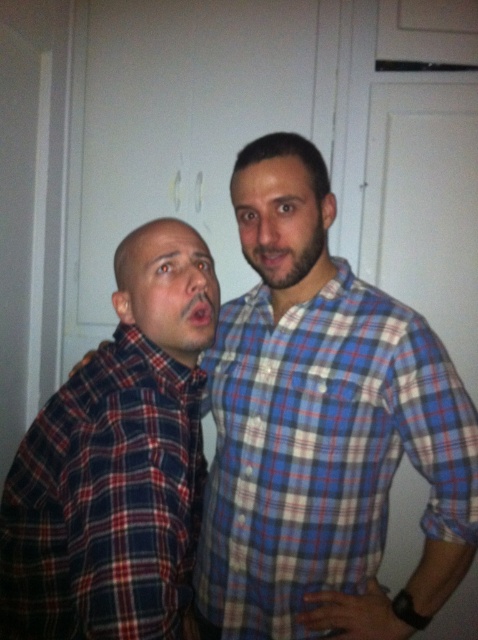
You are standing in front of the two people in the image. You need to determine which of the two points, point (x=172, y=316) or point (x=250, y=180), is closer to you. Which one is closer?

Point (x=172, y=316) is closer to the viewer than point (x=250, y=180), so the closer point is point (x=172, y=316).

You are a photographer setting up a shoot in the room described. You need to position a light source to the left of the matte plaid shirt at left to highlight it. Will this light source also illuminate the blue plaid shirt at center?

The blue plaid shirt at center is to the right of the matte plaid shirt at left. Since the light is placed to the left of the matte plaid shirt at left, it will likely illuminate both shirts as they are positioned next to each other with the light source on their shared left side.